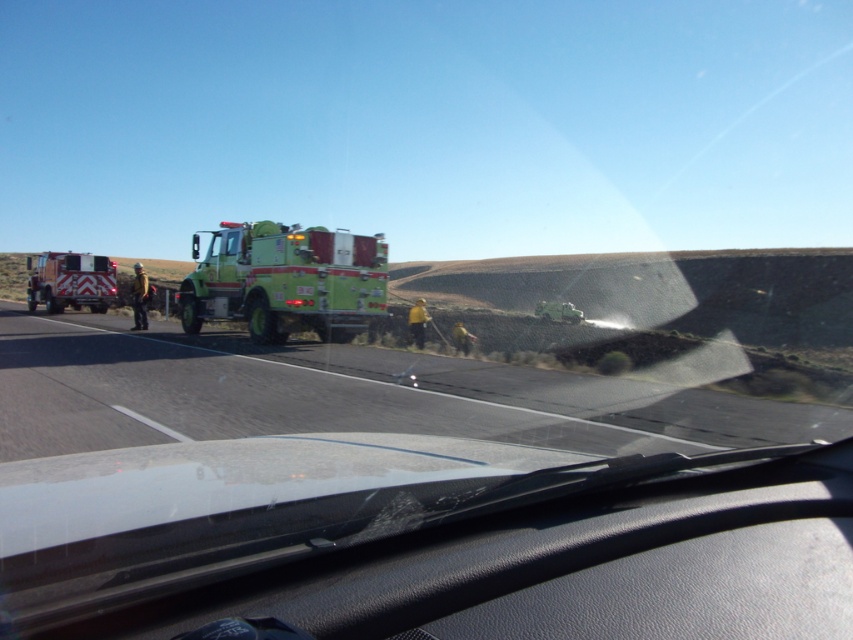
Question: Which of the following is the farthest from the observer?

Choices:
 (A) black asphalt highway at center
 (B) brushed metal fire truck at left
 (C) green matte fire truck at center

Answer: (B)

Question: Does green matte fire truck at center have a greater width compared to brushed metal fire truck at left?

Choices:
 (A) no
 (B) yes

Answer: (A)

Question: Can you confirm if black asphalt highway at center is thinner than green matte fire truck at center?

Choices:
 (A) yes
 (B) no

Answer: (B)

Question: Is black asphalt highway at center above green matte fire truck at center?

Choices:
 (A) no
 (B) yes

Answer: (A)

Question: Among these points, which one is nearest to the camera?

Choices:
 (A) (55, 256)
 (B) (380, 257)
 (C) (450, 362)

Answer: (C)

Question: Which point is farther to the camera?

Choices:
 (A) (267, 244)
 (B) (85, 282)

Answer: (B)